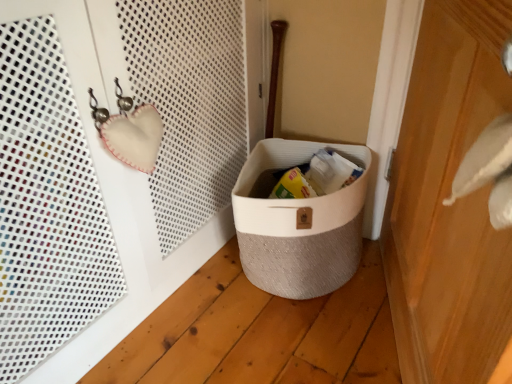
Question: Is point (441, 79) positioned closer to the camera than point (270, 163)?

Choices:
 (A) farther
 (B) closer

Answer: (B)

Question: Choose the correct answer: Is wooden door at right inside beige textured basket at lower center or outside it?

Choices:
 (A) inside
 (B) outside

Answer: (B)

Question: In the image, is wooden door at right positioned in front of or behind beige textured basket at lower center?

Choices:
 (A) front
 (B) behind

Answer: (A)

Question: From the image's perspective, is beige textured basket at lower center positioned above or below wooden door at right?

Choices:
 (A) above
 (B) below

Answer: (B)

Question: In the image, is beige textured basket at lower center positioned in front of or behind wooden door at right?

Choices:
 (A) behind
 (B) front

Answer: (A)

Question: From a real-world perspective, relative to wooden door at right, is beige textured basket at lower center vertically above or below?

Choices:
 (A) above
 (B) below

Answer: (B)

Question: Do you think beige textured basket at lower center is within wooden door at right, or outside of it?

Choices:
 (A) outside
 (B) inside

Answer: (A)